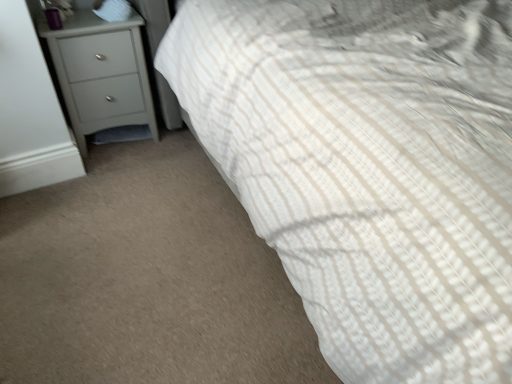
Image resolution: width=512 pixels, height=384 pixels. What do you see at coordinates (101, 74) in the screenshot?
I see `matte gray chest of drawers at left` at bounding box center [101, 74].

Where is `matte gray chest of drawers at left`? matte gray chest of drawers at left is located at coordinates (101, 74).

Image resolution: width=512 pixels, height=384 pixels. I want to click on white soft pillow at upper left, so click(x=113, y=10).

Measure the distance between point (113, 5) and camera.

They are 1.71 meters apart.

What do you see at coordinates (113, 10) in the screenshot? I see `white soft pillow at upper left` at bounding box center [113, 10].

At what (x,y) coordinates should I click in order to perform the action: click on matte gray chest of drawers at left. Please return your answer as a coordinate pair (x, y). Looking at the image, I should click on (101, 74).

Based on their positions, is white soft pillow at upper left located to the left or right of matte gray chest of drawers at left?

In the image, white soft pillow at upper left appears on the right side of matte gray chest of drawers at left.

Does white soft pillow at upper left come behind matte gray chest of drawers at left?

Yes.

Which is nearer, (106, 5) or (49, 41)?

Point (106, 5) is positioned farther from the camera compared to point (49, 41).

From the image's perspective, is white soft pillow at upper left on matte gray chest of drawers at left?

Yes, from the image's perspective, white soft pillow at upper left is on top of matte gray chest of drawers at left.

From a real-world perspective, is white soft pillow at upper left located beneath matte gray chest of drawers at left?

No.

Considering the sizes of white soft pillow at upper left and matte gray chest of drawers at left in the image, is white soft pillow at upper left wider or thinner than matte gray chest of drawers at left?

Considering their sizes, white soft pillow at upper left looks slimmer than matte gray chest of drawers at left.

Is white soft pillow at upper left shorter than matte gray chest of drawers at left?

Yes.

Based on their sizes in the image, would you say white soft pillow at upper left is bigger or smaller than matte gray chest of drawers at left?

In the image, white soft pillow at upper left appears to be smaller than matte gray chest of drawers at left.

Which is correct: white soft pillow at upper left is inside matte gray chest of drawers at left, or outside of it?

The correct answer is: outside.

Is white soft pillow at upper left far from matte gray chest of drawers at left?

white soft pillow at upper left is actually quite close to matte gray chest of drawers at left.

Does white soft pillow at upper left turn towards matte gray chest of drawers at left?

No.

What's the angular difference between white soft pillow at upper left and matte gray chest of drawers at left's facing directions?

The facing directions of white soft pillow at upper left and matte gray chest of drawers at left are 6.04 degrees apart.

In the image, there is a white soft pillow at upper left. At what (x,y) coordinates should I click in order to perform the action: click on the chest of drawers below it (from a real-world perspective). Please return your answer as a coordinate pair (x, y). This screenshot has height=384, width=512. Looking at the image, I should click on (101, 74).

Visually, is matte gray chest of drawers at left positioned to the left or to the right of white soft pillow at upper left?

From the image, it's evident that matte gray chest of drawers at left is to the left of white soft pillow at upper left.

Does matte gray chest of drawers at left come behind white soft pillow at upper left?

That is False.

Which is farther, (106, 76) or (111, 0)?

Point (106, 76)

Consider the image. From the image's perspective, who appears lower, matte gray chest of drawers at left or white soft pillow at upper left?

matte gray chest of drawers at left appears lower in the image.

From a real-world perspective, is matte gray chest of drawers at left positioned above or below white soft pillow at upper left?

In terms of real-world spatial position, matte gray chest of drawers at left is below white soft pillow at upper left.

Which object is thinner, matte gray chest of drawers at left or white soft pillow at upper left?

Thinner between the two is white soft pillow at upper left.

Considering the relative sizes of matte gray chest of drawers at left and white soft pillow at upper left in the image provided, is matte gray chest of drawers at left taller than white soft pillow at upper left?

Indeed, matte gray chest of drawers at left has a greater height compared to white soft pillow at upper left.

Does matte gray chest of drawers at left have a larger size compared to white soft pillow at upper left?

Yes, matte gray chest of drawers at left is bigger than white soft pillow at upper left.

Do you think matte gray chest of drawers at left is within white soft pillow at upper left, or outside of it?

The correct answer is: outside.

Is matte gray chest of drawers at left next to white soft pillow at upper left and touching it?

No, matte gray chest of drawers at left is not next to white soft pillow at upper left.

Is matte gray chest of drawers at left looking in the opposite direction of white soft pillow at upper left?

No.

How different are the orientations of matte gray chest of drawers at left and white soft pillow at upper left in degrees?

The angle between the facing direction of matte gray chest of drawers at left and the facing direction of white soft pillow at upper left is 6.04 degrees.

You are a GUI agent. You are given a task and a screenshot of the screen. Output one action in this format:
    pyautogui.click(x=<x>, y=<y>)
    Task: Click on the chest of drawers lying in front of the white soft pillow at upper left
    This screenshot has height=384, width=512.
    Given the screenshot: What is the action you would take?
    pyautogui.click(x=101, y=74)

I want to click on pillow that appears on the right of matte gray chest of drawers at left, so click(113, 10).

Where is `chest of drawers on the left of white soft pillow at upper left`? chest of drawers on the left of white soft pillow at upper left is located at coordinates (101, 74).